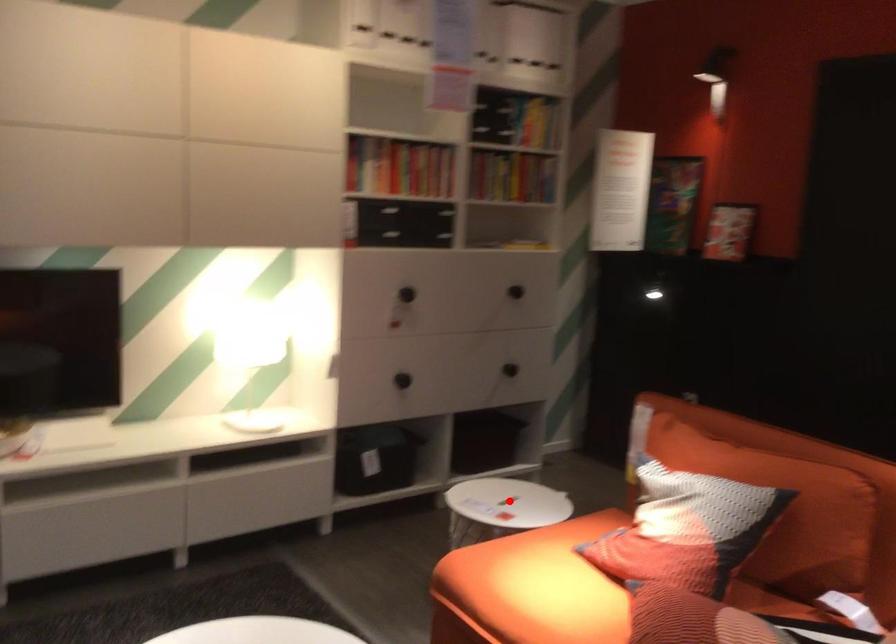
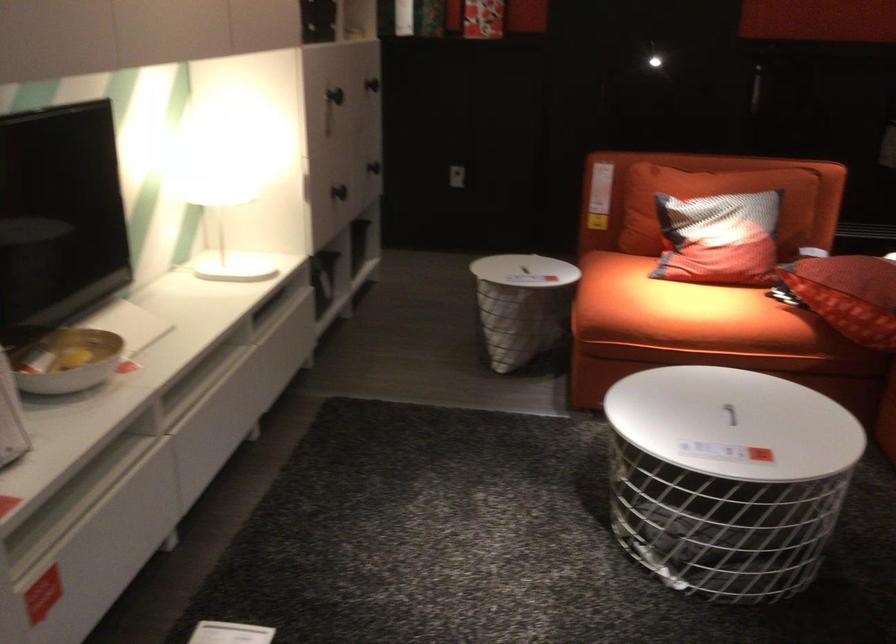
Question: I am providing you with two images of the same scene from different viewpoints. Given a red point in image1, look at the same physical point in image2. Is it:

Choices:
 (A) Closer to the viewpoint
 (B) Farther from the viewpoint

Answer: (B)